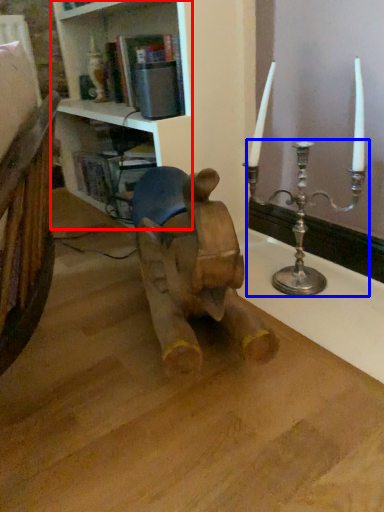
Question: Which point is closer to the camera, shelf (highlighted by a red box) or candle holder (highlighted by a blue box)?

Choices:
 (A) shelf
 (B) candle holder

Answer: (A)